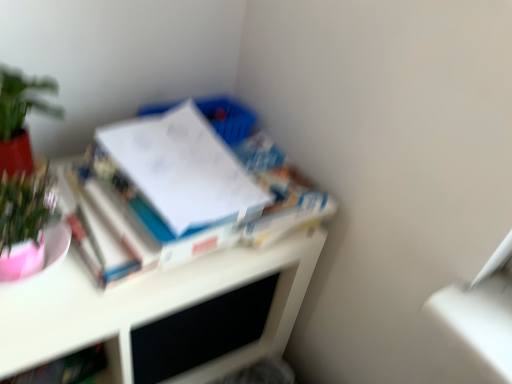
Question: Is green matte plant at upper left outside white glossy desk at upper left?

Choices:
 (A) yes
 (B) no

Answer: (A)

Question: Is green matte plant at upper left at the left side of white glossy desk at upper left?

Choices:
 (A) no
 (B) yes

Answer: (B)

Question: Is there a large distance between green matte plant at upper left and white glossy desk at upper left?

Choices:
 (A) yes
 (B) no

Answer: (B)

Question: Considering the relative sizes of green matte plant at upper left and white glossy desk at upper left in the image provided, is green matte plant at upper left wider than white glossy desk at upper left?

Choices:
 (A) no
 (B) yes

Answer: (A)

Question: Is green matte plant at upper left oriented away from white glossy desk at upper left?

Choices:
 (A) no
 (B) yes

Answer: (A)

Question: Is green matte plant at upper left oriented towards white glossy desk at upper left?

Choices:
 (A) no
 (B) yes

Answer: (A)

Question: Is green matte plant at upper left wider than hardcover book at lower left, arranged as the first book when viewed from the left?

Choices:
 (A) yes
 (B) no

Answer: (A)

Question: Can you confirm if green matte plant at upper left is bigger than hardcover book at lower left, which is the first book in bottom-to-top order?

Choices:
 (A) yes
 (B) no

Answer: (A)

Question: From a real-world perspective, is green matte plant at upper left located higher than hardcover book at lower left, which is the 2th book from right to left?

Choices:
 (A) yes
 (B) no

Answer: (A)

Question: Is the position of green matte plant at upper left more distant than that of hardcover book at lower left, which is the first book in bottom-to-top order?

Choices:
 (A) no
 (B) yes

Answer: (A)

Question: Is green matte plant at upper left positioned with its back to hardcover book at lower left, which is the first book in bottom-to-top order?

Choices:
 (A) yes
 (B) no

Answer: (B)

Question: From a real-world perspective, is green matte plant at upper left beneath hardcover book at lower left, which is the 2th book from right to left?

Choices:
 (A) no
 (B) yes

Answer: (A)

Question: From a real-world perspective, is white glossy desk at upper left located beneath white glossy book at upper left, the second book when ordered from left to right?

Choices:
 (A) no
 (B) yes

Answer: (B)